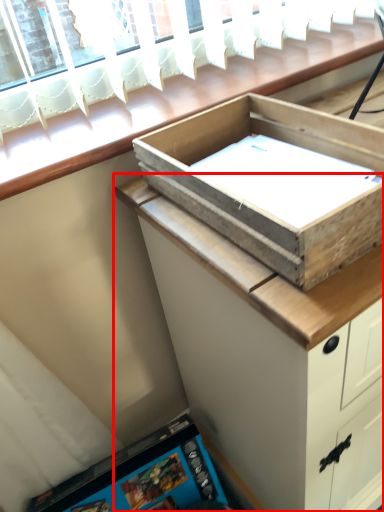
Question: From the image's perspective, what is the correct spatial positioning of cabinetry (annotated by the red box) in reference to box?

Choices:
 (A) above
 (B) below

Answer: (B)